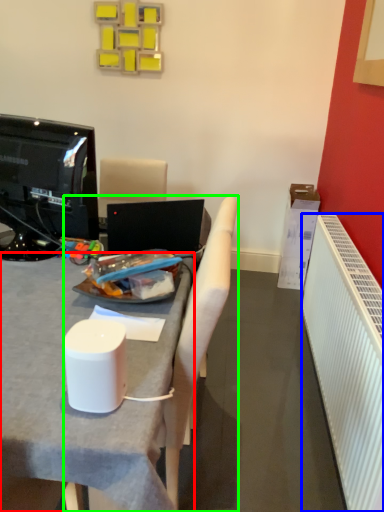
Question: Which object is the farthest from desk (highlighted by a red box)? Choose among these: radiator (highlighted by a blue box) or chair (highlighted by a green box).

Choices:
 (A) radiator
 (B) chair

Answer: (A)